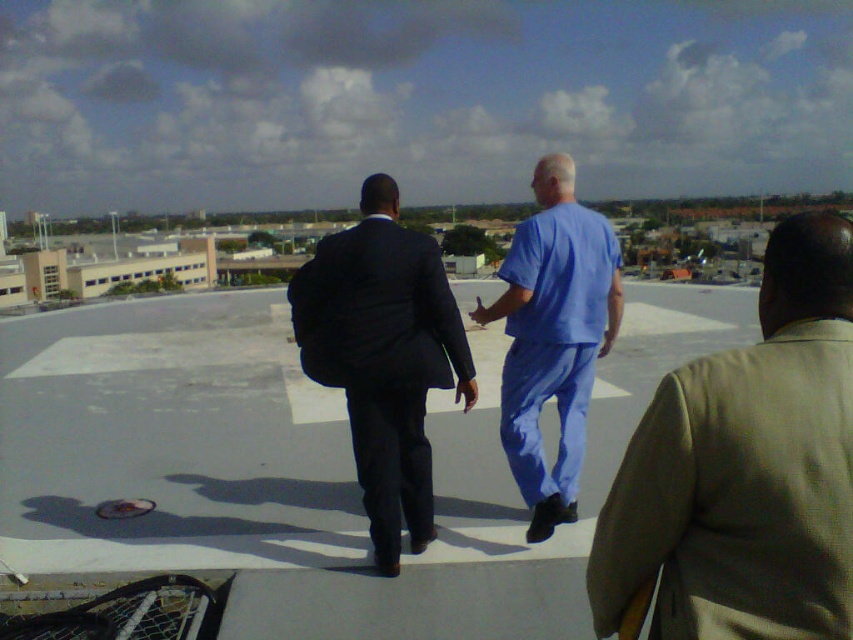
Who is taller, light brown textured suit at right or matte black suit at center?

matte black suit at center

Who is lower down, light brown textured suit at right or matte black suit at center?

light brown textured suit at right

Between point (845, 225) and point (392, 300), which one is positioned behind?

The point (392, 300) is behind.

Locate an element on the screen. Image resolution: width=853 pixels, height=640 pixels. light brown textured suit at right is located at coordinates (746, 468).

Can you confirm if light brown textured suit at right is positioned below blue scrubs at center?

Yes, light brown textured suit at right is below blue scrubs at center.

Does point (849, 292) come closer to viewer compared to point (520, 280)?

Yes, point (849, 292) is in front of point (520, 280).

Image resolution: width=853 pixels, height=640 pixels. In order to click on light brown textured suit at right in this screenshot , I will do `click(746, 468)`.

Describe the element at coordinates (383, 356) in the screenshot. I see `matte black suit at center` at that location.

Can you confirm if matte black suit at center is positioned to the right of matte blue scrubs at center?

In fact, matte black suit at center is to the left of matte blue scrubs at center.

What do you see at coordinates (383, 356) in the screenshot?
I see `matte black suit at center` at bounding box center [383, 356].

In order to click on matte black suit at center in this screenshot , I will do `click(383, 356)`.